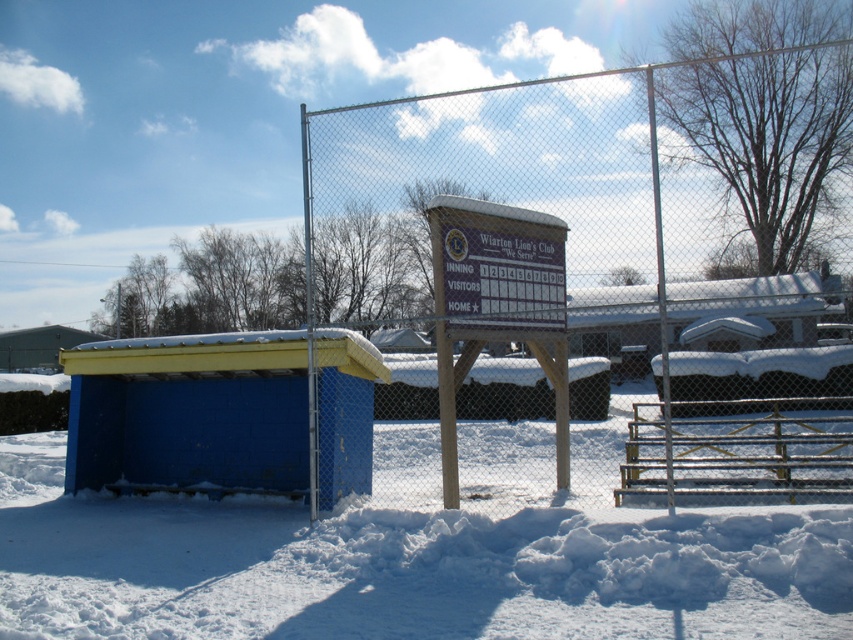
You are a photographer trying to capture the snowy landscape. You notice the white fluffy snow at lower center and the yellow plastic hut at lower left. Which object takes up more area in the image?

The yellow plastic hut at lower left takes up more area in the image than the white fluffy snow at lower center.